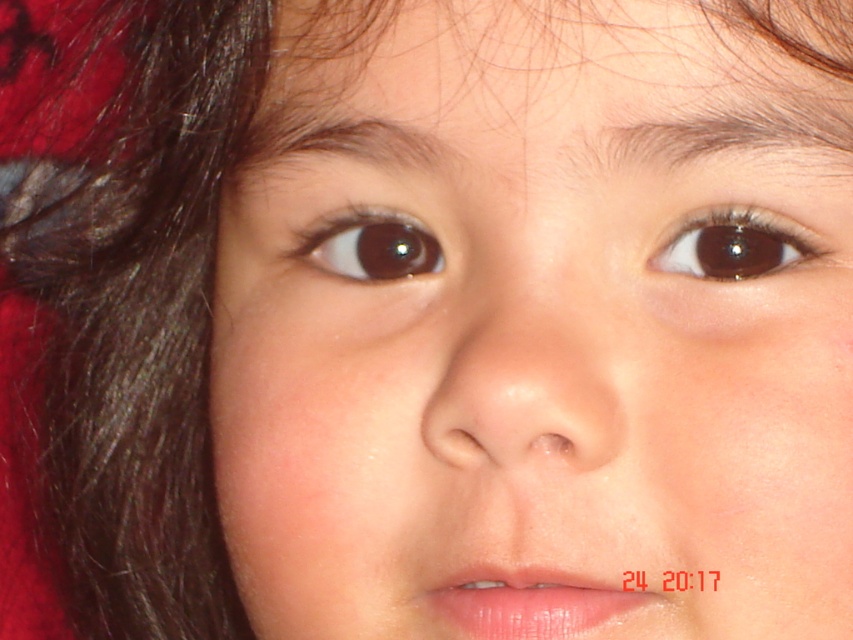
Who is more forward, (827, 150) or (756, 227)?

Point (827, 150) is in front.

Is point (699, 104) positioned before point (755, 221)?

Yes, point (699, 104) is in front of point (755, 221).

Where is `brown hair at upper center`? Image resolution: width=853 pixels, height=640 pixels. brown hair at upper center is located at coordinates (728, 129).

Is smooth skin at upper center smaller than brown shiny eye at upper center?

No.

Can you confirm if smooth skin at upper center is shorter than brown shiny eye at upper center?

Incorrect, smooth skin at upper center's height does not fall short of brown shiny eye at upper center's.

Find the location of a particular element. Image resolution: width=853 pixels, height=640 pixels. smooth skin at upper center is located at coordinates (560, 72).

Which is more to the left, smooth skin nose at center or brown shiny eye at upper center?

smooth skin nose at center is more to the left.

Is smooth skin nose at center wider than brown shiny eye at upper center?

Indeed, smooth skin nose at center has a greater width compared to brown shiny eye at upper center.

Which is behind, point (526, 428) or point (694, 244)?

Positioned behind is point (694, 244).

The width and height of the screenshot is (853, 640). Identify the location of smooth skin nose at center. (521, 394).